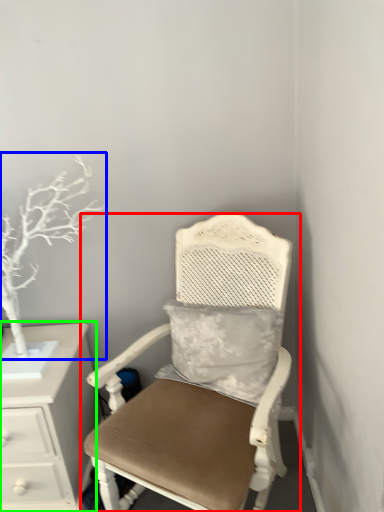
Question: Based on their relative distances, which object is farther from chair (highlighted by a red box)? Choose from tree (highlighted by a blue box) and chest of drawers (highlighted by a green box).

Choices:
 (A) tree
 (B) chest of drawers

Answer: (A)